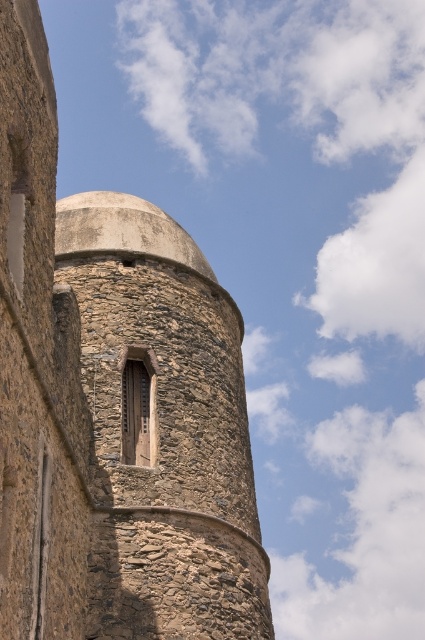
Question: Is rustic stone tower at center thinner than stone textured window at center?

Choices:
 (A) no
 (B) yes

Answer: (A)

Question: Can you confirm if rustic stone tower at center is thinner than stone textured window at center?

Choices:
 (A) no
 (B) yes

Answer: (A)

Question: Can you confirm if rustic stone tower at center is positioned to the left of stone textured window at center?

Choices:
 (A) yes
 (B) no

Answer: (A)

Question: Which point is closer to the camera?

Choices:
 (A) (200, 608)
 (B) (130, 449)

Answer: (A)

Question: Which point is closer to the camera?

Choices:
 (A) stone textured window at center
 (B) rustic stone tower at center

Answer: (B)